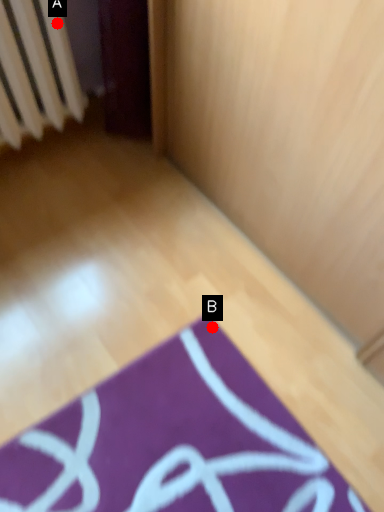
Question: Two points are circled on the image, labeled by A and B beside each circle. Which point is closer to the camera?

Choices:
 (A) A is closer
 (B) B is closer

Answer: (A)